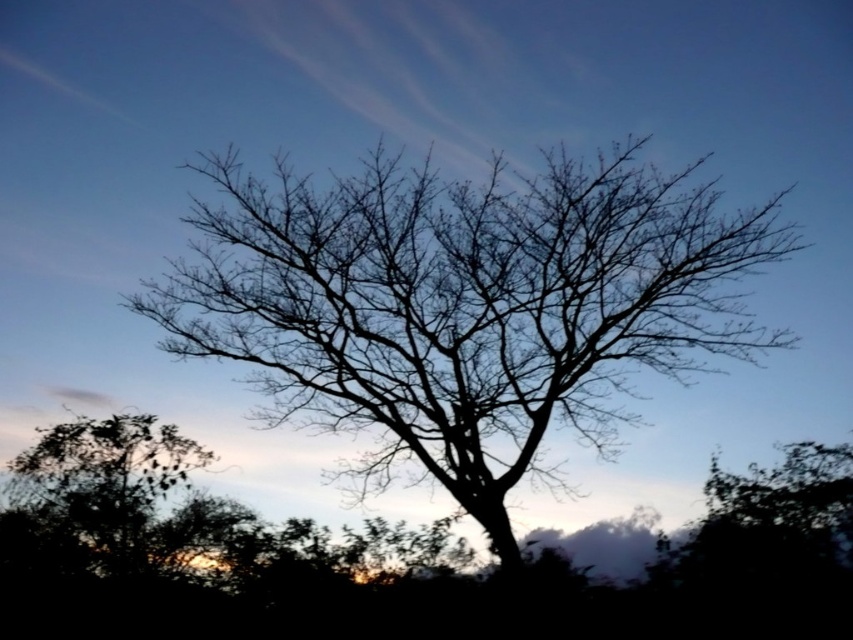
Does silhouette bark tree at center have a larger size compared to green leafy tree at lower left?

Yes, silhouette bark tree at center is bigger than green leafy tree at lower left.

Who is more forward, (514, 280) or (138, 467)?

Point (514, 280) is in front.

The width and height of the screenshot is (853, 640). Identify the location of silhouette bark tree at center. (463, 305).